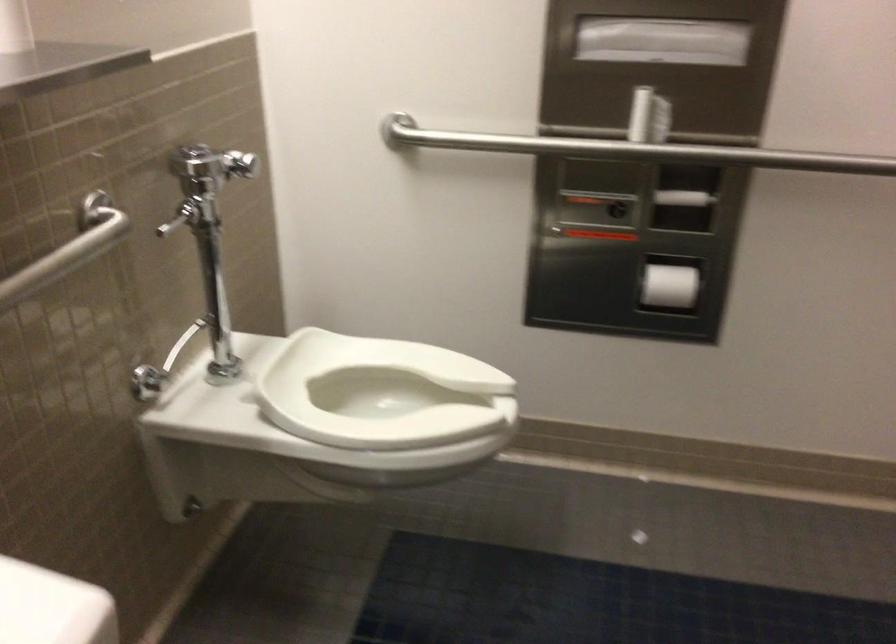
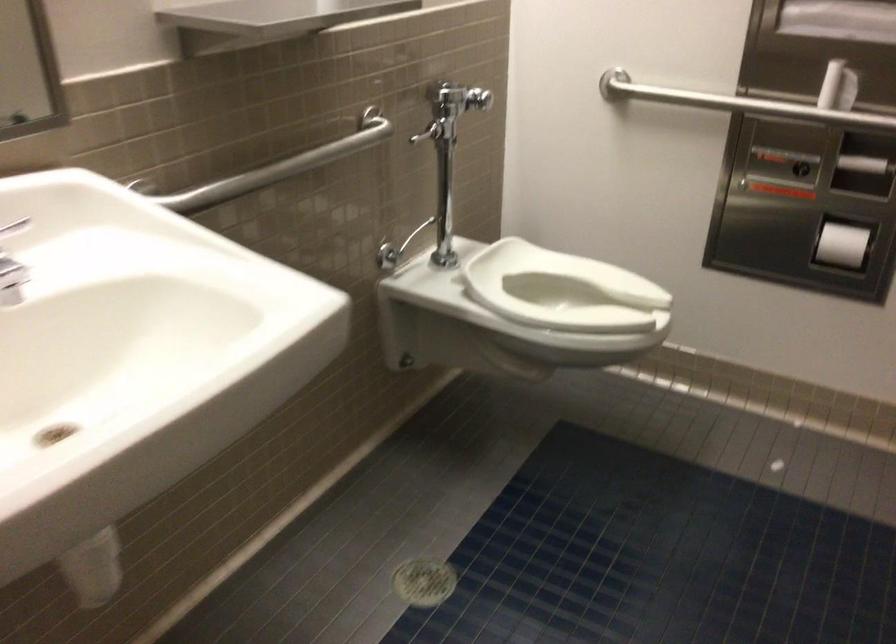
Locate, in the second image, the point that corresponds to pixel 648 124 in the first image.

(838, 87)